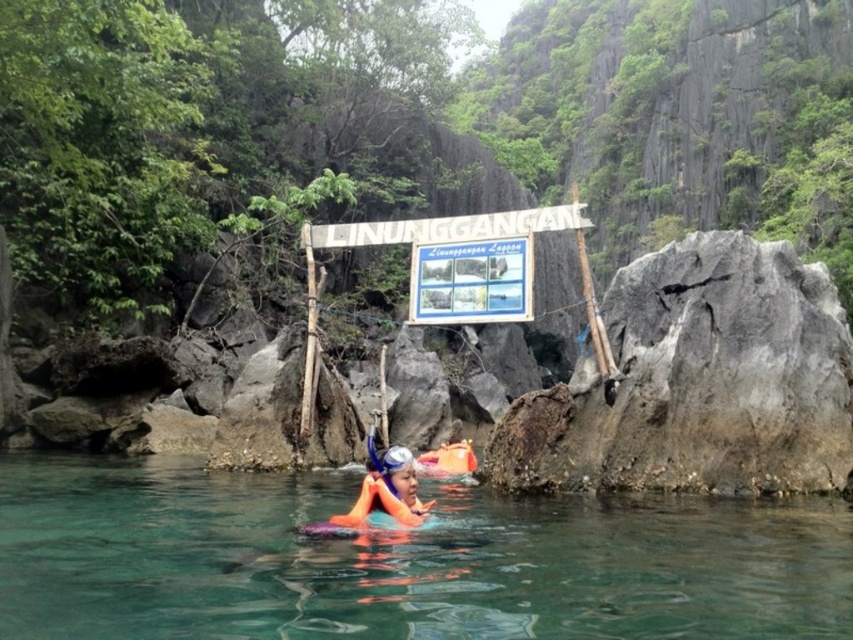
Question: Among these points, which one is farthest from the camera?

Choices:
 (A) (3, 611)
 (B) (759, 348)

Answer: (B)

Question: Is gray rough rock at right further to camera compared to orange life jacket at center?

Choices:
 (A) yes
 (B) no

Answer: (A)

Question: Which object is positioned closest to the orange life jacket at center?

Choices:
 (A) clear water at center
 (B) gray rough rock at right
 (C) white plastic sign at center

Answer: (A)

Question: Which object appears closest to the camera in this image?

Choices:
 (A) gray rough rock at right
 (B) orange life jacket at center
 (C) clear water at center

Answer: (C)

Question: Is clear water at center to the left of gray rough rock at right from the viewer's perspective?

Choices:
 (A) yes
 (B) no

Answer: (A)

Question: Can you confirm if clear water at center is positioned below white plastic sign at center?

Choices:
 (A) yes
 (B) no

Answer: (A)